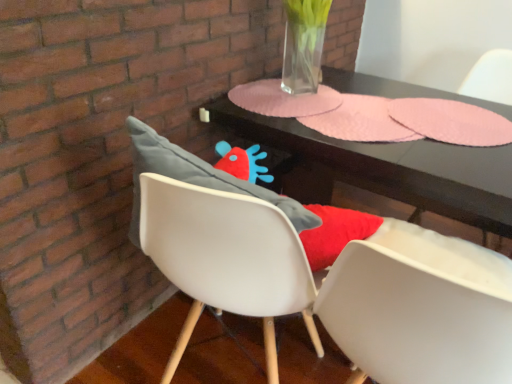
I want to click on matte gray cushion at center, so coord(247,195).

Describe the element at coordinates (490, 77) in the screenshot. The height and width of the screenshot is (384, 512). I see `white matte armchair at upper right` at that location.

Identify the location of matte gray cushion at center. (247, 195).

Considering the sizes of objects white matte armchair at upper right and pink paper placemats at center in the image provided, who is shorter, white matte armchair at upper right or pink paper placemats at center?

pink paper placemats at center is shorter.

Looking at this image, from the image's perspective, which one is positioned higher, white matte armchair at upper right or pink paper placemats at center?

pink paper placemats at center, from the image's perspective.

In terms of size, does white matte armchair at upper right appear bigger or smaller than pink paper placemats at center?

In the image, white matte armchair at upper right appears to be larger than pink paper placemats at center.

Considering the relative sizes of white matte armchair at upper right and pink paper placemats at center in the image provided, is white matte armchair at upper right thinner than pink paper placemats at center?

Indeed, white matte armchair at upper right has a lesser width compared to pink paper placemats at center.

Where is `chair located on the right of pink paper placemats at center`? This screenshot has height=384, width=512. chair located on the right of pink paper placemats at center is located at coordinates (247, 195).

Does matte gray cushion at center have a smaller size compared to pink paper placemats at center?

No, matte gray cushion at center is not smaller than pink paper placemats at center.

From the image's perspective, which one is positioned lower, matte gray cushion at center or pink paper placemats at center?

matte gray cushion at center, from the image's perspective.

Looking at this image, considering the relative sizes of pink paper placemats at center and white matte armchair at upper right in the image provided, is pink paper placemats at center thinner than white matte armchair at upper right?

No, pink paper placemats at center is not thinner than white matte armchair at upper right.

The width and height of the screenshot is (512, 384). What are the coordinates of `armchair lying below the pink paper placemats at center (from the image's perspective)` in the screenshot? It's located at (490, 77).

Which point is more distant from viewer, (411,216) or (418,213)?

The point (418,213) is farther.

Based on the photo, from the image's perspective, is pink paper placemats at center positioned above or below white matte armchair at upper right?

pink paper placemats at center is above white matte armchair at upper right.

Is matte gray cushion at center to the left or to the right of white matte armchair at upper right in the image?

From the image, it's evident that matte gray cushion at center is to the left of white matte armchair at upper right.

Looking at this image, is matte gray cushion at center touching white matte armchair at upper right?

No, matte gray cushion at center is not with white matte armchair at upper right.

Which point is more forward, (351, 210) or (478, 73)?

The point (351, 210) is closer.

Is matte gray cushion at center looking in the opposite direction of white matte armchair at upper right?

That's not correct — matte gray cushion at center is not looking away from white matte armchair at upper right.

Can you confirm if white matte armchair at upper right is bigger than matte gray cushion at center?

No.

Is white matte armchair at upper right wider than matte gray cushion at center?

In fact, white matte armchair at upper right might be narrower than matte gray cushion at center.

Does point (489, 54) lie behind point (138, 156)?

Yes.

Is white matte armchair at upper right beside matte gray cushion at center?

No, white matte armchair at upper right is not making contact with matte gray cushion at center.

Based on the photo, does pink paper placemats at center have a greater height compared to matte gray cushion at center?

Incorrect, the height of pink paper placemats at center is not larger of that of matte gray cushion at center.

Is matte gray cushion at center a part of pink paper placemats at center?

That's incorrect, matte gray cushion at center is not inside pink paper placemats at center.

From the image's perspective, would you say pink paper placemats at center is positioned over matte gray cushion at center?

Yes, from the image's perspective, pink paper placemats at center is over matte gray cushion at center.

Between point (221, 121) and point (227, 183), which one is positioned in front?

Point (227, 183)

In order to click on armchair below the pink paper placemats at center (from a real-world perspective) in this screenshot , I will do click(x=490, y=77).

Locate an element on the screen. table located behind the matte gray cushion at center is located at coordinates (377, 168).

From the image, which object appears to be nearer to white matte armchair at upper right, pink paper placemats at center or matte gray cushion at center?

Among the two, pink paper placemats at center is located nearer to white matte armchair at upper right.

Looking at the image, which one is located closer to white matte armchair at upper right, matte gray cushion at center or pink paper placemats at center?

pink paper placemats at center lies closer to white matte armchair at upper right than the other object.

When comparing their distances from matte gray cushion at center, does white matte armchair at upper right or pink paper placemats at center seem closer?

Based on the image, pink paper placemats at center appears to be nearer to matte gray cushion at center.

Estimate the real-world distances between objects in this image. Which object is closer to pink paper placemats at center, white matte armchair at upper right or matte gray cushion at center?

The object closer to pink paper placemats at center is matte gray cushion at center.

Considering their positions, is pink paper placemats at center positioned further to matte gray cushion at center than white matte armchair at upper right?

Based on the image, white matte armchair at upper right appears to be further to matte gray cushion at center.

From the image, which object appears to be farther from pink paper placemats at center, matte gray cushion at center or white matte armchair at upper right?

Among the two, white matte armchair at upper right is located further to pink paper placemats at center.

Identify the location of chair situated between pink paper placemats at center and white matte armchair at upper right from left to right. (247, 195).